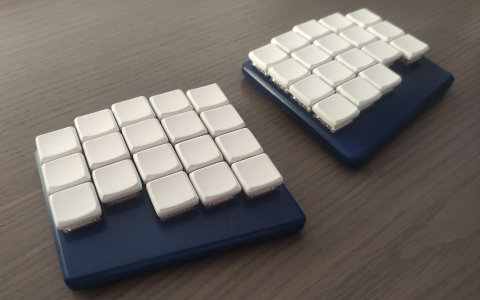
Where is `wood grain lines`? Image resolution: width=480 pixels, height=300 pixels. wood grain lines is located at coordinates (382, 229), (360, 225), (351, 213), (339, 203), (391, 246).